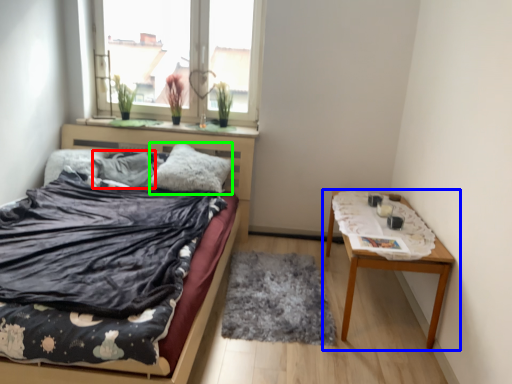
Question: Which object is positioned farthest from pillow (highlighted by a red box)? Select from table (highlighted by a blue box) and pillow (highlighted by a green box).

Choices:
 (A) table
 (B) pillow

Answer: (A)